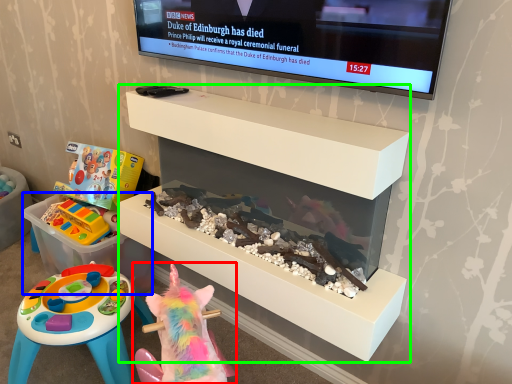
Question: Considering the real-world distances, which object is closest to toy (highlighted by a red box)? storage box (highlighted by a blue box) or furniture (highlighted by a green box).

Choices:
 (A) storage box
 (B) furniture

Answer: (B)